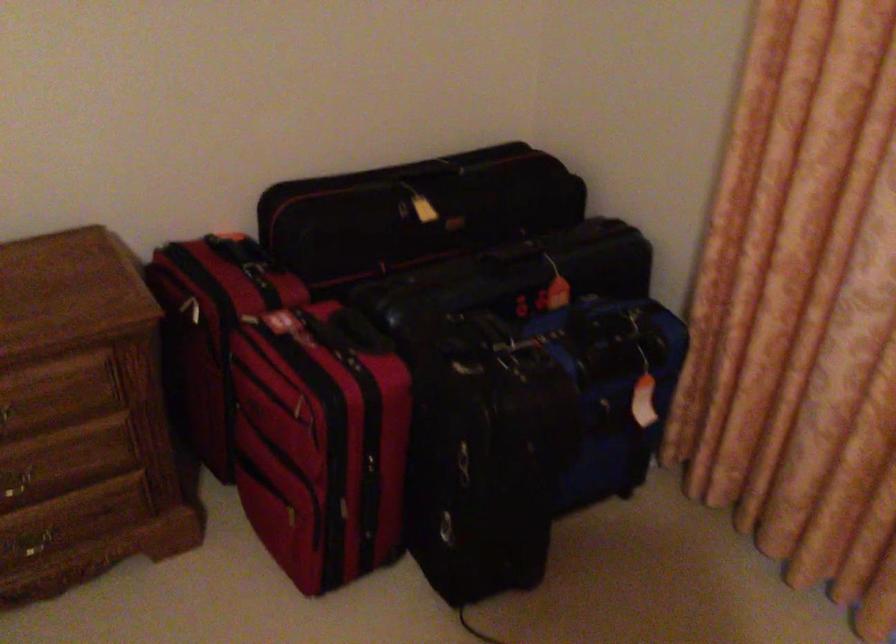
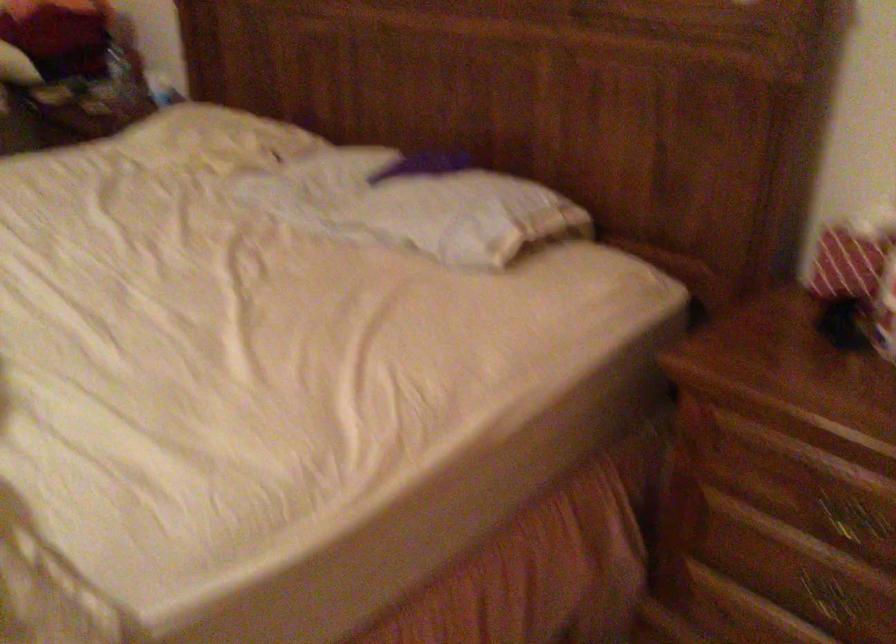
Question: The camera is either moving clockwise (left) or counter-clockwise (right) around the object. The first image is from the beginning of the video and the second image is from the end. Is the camera moving left or right when shooting the video?

Choices:
 (A) Left
 (B) Right

Answer: (B)